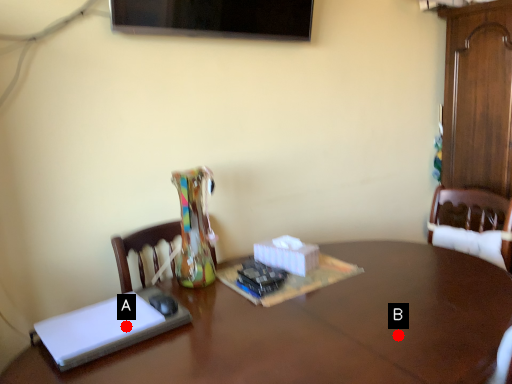
Question: Two points are circled on the image, labeled by A and B beside each circle. Among these points, which one is nearest to the camera?

Choices:
 (A) A is closer
 (B) B is closer

Answer: (B)